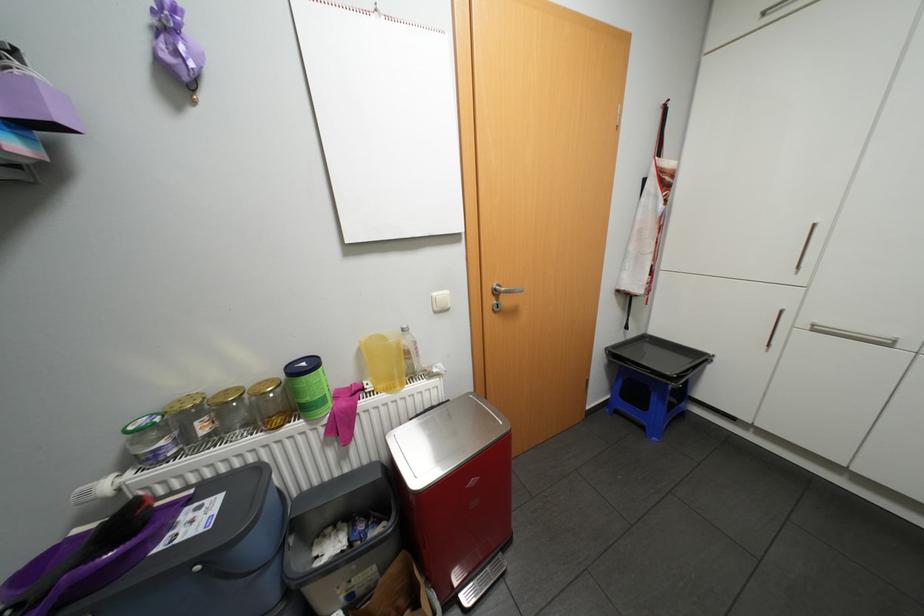
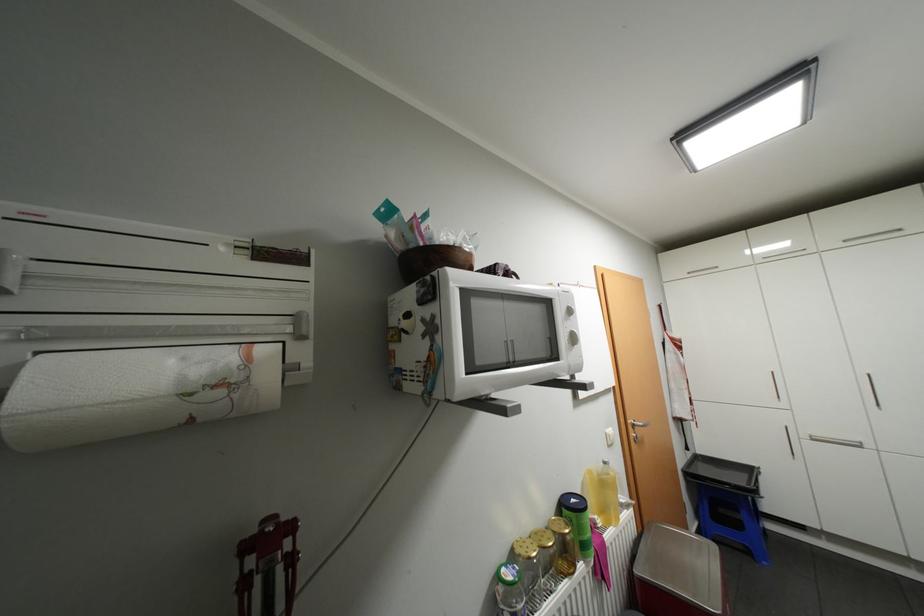
In the second image, find the point that corresponds to point (311, 363) in the first image.

(580, 499)